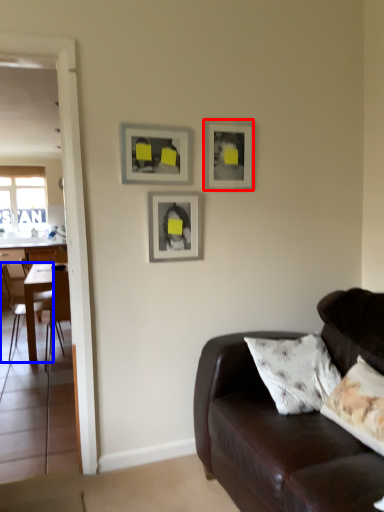
Question: Among these objects, which one is nearest to the camera, picture frame (highlighted by a red box) or chair (highlighted by a blue box)?

Choices:
 (A) picture frame
 (B) chair

Answer: (A)